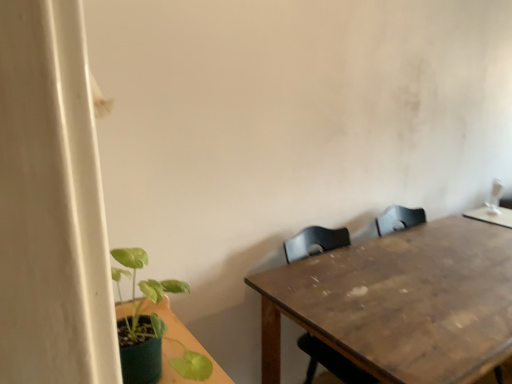
Question: From the image's perspective, is green matte plant at lower left located beneath wooden table at center?

Choices:
 (A) yes
 (B) no

Answer: (B)

Question: Does green matte plant at lower left have a larger size compared to wooden table at center?

Choices:
 (A) no
 (B) yes

Answer: (A)

Question: Considering the relative sizes of green matte plant at lower left and wooden table at center in the image provided, is green matte plant at lower left shorter than wooden table at center?

Choices:
 (A) yes
 (B) no

Answer: (A)

Question: Is there a large distance between green matte plant at lower left and wooden table at center?

Choices:
 (A) yes
 (B) no

Answer: (B)

Question: Considering the relative positions of green matte plant at lower left and wooden table at center in the image provided, is green matte plant at lower left to the right of wooden table at center from the viewer's perspective?

Choices:
 (A) yes
 (B) no

Answer: (B)

Question: Can you confirm if green matte plant at lower left is smaller than wooden table at center?

Choices:
 (A) yes
 (B) no

Answer: (A)

Question: Is wooden table at center not within green matte plant at lower left?

Choices:
 (A) no
 (B) yes

Answer: (B)

Question: Is wooden table at center thinner than green matte plant at lower left?

Choices:
 (A) yes
 (B) no

Answer: (B)

Question: Is the depth of wooden table at center less than that of green matte plant at lower left?

Choices:
 (A) no
 (B) yes

Answer: (A)

Question: Is wooden table at center in contact with green matte plant at lower left?

Choices:
 (A) yes
 (B) no

Answer: (B)

Question: Would you say wooden table at center contains green matte plant at lower left?

Choices:
 (A) yes
 (B) no

Answer: (B)

Question: Is wooden table at center turned away from green matte plant at lower left?

Choices:
 (A) no
 (B) yes

Answer: (A)

Question: From a real-world perspective, is wooden table at center positioned above or below green matte plant at lower left?

Choices:
 (A) above
 (B) below

Answer: (B)